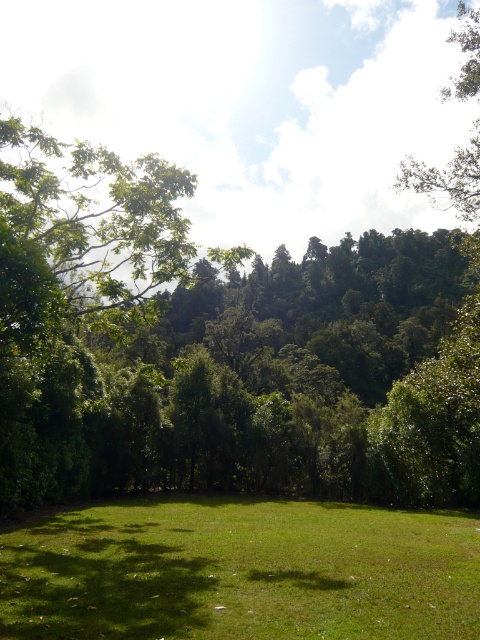
You are planning to set up a picnic area in the green grass at center. Considering the space occupied by the green leafy tree at upper right, will there be enough room for a picnic blanket that requires 4 square meters of open space?

The green grass at center occupies less space than the green leafy tree at upper right. Since the tree takes up more area, the grassy spot might not have enough space for the 4 square meter picnic blanket. Check the exact measurements before setting up.